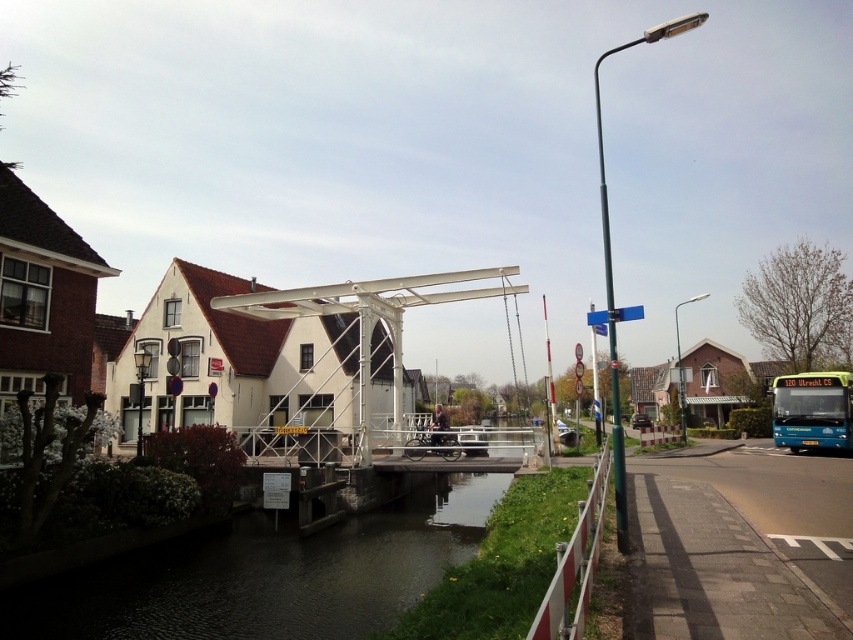
From the picture: You are a delivery drone that needs to fly over the dark water at center and the metallic pole at right. Which path requires more caution due to the object being narrower?

The dark water at center requires more caution because its width is less than the metallic pole at right.

You are a tourist standing on the white bridge with a red roof, looking towards the dark water at center and the metallic pole at right. Which object is closer to your right side?

The metallic pole at right is closer to your right side because it is positioned to the right of the dark water at center.